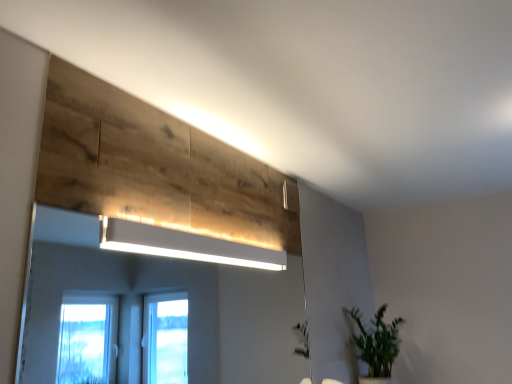
Identify the location of white glossy mirror at upper center. (165, 292).

Locate an element on the screen. The image size is (512, 384). white glossy mirror at upper center is located at coordinates point(165,292).

Is white matte rectangular light at upper center not near white glossy mirror at upper center?

white matte rectangular light at upper center is far away from white glossy mirror at upper center.

At what (x,y) coordinates should I click in order to perform the action: click on mirror below the white matte rectangular light at upper center (from the image's perspective). Please return your answer as a coordinate pair (x, y). This screenshot has width=512, height=384. Looking at the image, I should click on (165, 292).

From a real-world perspective, is white matte rectangular light at upper center above or below white glossy mirror at upper center?

From a real-world perspective, white matte rectangular light at upper center is physically above white glossy mirror at upper center.

Which is more to the left, white matte rectangular light at upper center or white glossy mirror at upper center?

white glossy mirror at upper center.

Does white glossy mirror at upper center have a lesser width compared to white matte rectangular light at upper center?

Yes.

Does white glossy mirror at upper center touch white matte rectangular light at upper center?

white glossy mirror at upper center and white matte rectangular light at upper center are not in contact.

Which object is positioned more to the right, white glossy mirror at upper center or white matte rectangular light at upper center?

From the viewer's perspective, white matte rectangular light at upper center appears more on the right side.

Can you see white glossy mirror at upper center touching green leafy plant at lower right?

No, white glossy mirror at upper center is not making contact with green leafy plant at lower right.

Does white glossy mirror at upper center lie in front of green leafy plant at lower right?

Yes.

Which is more to the left, white glossy mirror at upper center or green leafy plant at lower right?

From the viewer's perspective, white glossy mirror at upper center appears more on the left side.

Is white glossy mirror at upper center turned away from green leafy plant at lower right?

That's not correct — white glossy mirror at upper center is not looking away from green leafy plant at lower right.

From a real-world perspective, does green leafy plant at lower right stand above white matte rectangular light at upper center?

No, from a real-world perspective, green leafy plant at lower right is not above white matte rectangular light at upper center.

Consider the image. From the image's perspective, which object appears higher, green leafy plant at lower right or white matte rectangular light at upper center?

white matte rectangular light at upper center, from the image's perspective.

Is green leafy plant at lower right far away from white matte rectangular light at upper center?

Yes, green leafy plant at lower right and white matte rectangular light at upper center are quite far apart.

Which object is wider, green leafy plant at lower right or white matte rectangular light at upper center?

green leafy plant at lower right is wider.

From a real-world perspective, is white matte rectangular light at upper center located beneath green leafy plant at lower right?

No, from a real-world perspective, white matte rectangular light at upper center is not under green leafy plant at lower right.

Is green leafy plant at lower right at the back of white matte rectangular light at upper center?

white matte rectangular light at upper center does not have its back to green leafy plant at lower right.

Looking at this image, considering the sizes of objects white matte rectangular light at upper center and green leafy plant at lower right in the image provided, who is smaller, white matte rectangular light at upper center or green leafy plant at lower right?

white matte rectangular light at upper center.

Which of these two, green leafy plant at lower right or white glossy mirror at upper center, is bigger?

green leafy plant at lower right.

Which of these two, green leafy plant at lower right or white glossy mirror at upper center, is wider?

With larger width is green leafy plant at lower right.

Based on the photo, in the image, is green leafy plant at lower right positioned in front of or behind white glossy mirror at upper center?

green leafy plant at lower right is positioned farther from the viewer than white glossy mirror at upper center.

Is the surface of green leafy plant at lower right in direct contact with white glossy mirror at upper center?

No, green leafy plant at lower right is not with white glossy mirror at upper center.

At what (x,y) coordinates should I click in order to perform the action: click on mirror in front of the white matte rectangular light at upper center. Please return your answer as a coordinate pair (x, y). This screenshot has height=384, width=512. Looking at the image, I should click on (165, 292).

Find the location of a particular element. This screenshot has width=512, height=384. lamp on the right side of white glossy mirror at upper center is located at coordinates (185, 245).

From the image, which object appears to be nearer to white glossy mirror at upper center, green leafy plant at lower right or white matte rectangular light at upper center?

green leafy plant at lower right is positioned closer to the anchor white glossy mirror at upper center.

Estimate the real-world distances between objects in this image. Which object is closer to white matte rectangular light at upper center, white glossy mirror at upper center or green leafy plant at lower right?

green leafy plant at lower right is positioned closer to the anchor white matte rectangular light at upper center.

Estimate the real-world distances between objects in this image. Which object is further from green leafy plant at lower right, white glossy mirror at upper center or white matte rectangular light at upper center?

Among the two, white glossy mirror at upper center is located further to green leafy plant at lower right.

Which object lies further to the anchor point white matte rectangular light at upper center, green leafy plant at lower right or white glossy mirror at upper center?

Based on the image, white glossy mirror at upper center appears to be further to white matte rectangular light at upper center.

From the image, which object appears to be farther from white glossy mirror at upper center, white matte rectangular light at upper center or green leafy plant at lower right?

Among the two, white matte rectangular light at upper center is located further to white glossy mirror at upper center.

In the scene shown: Looking at the image, which one is located closer to green leafy plant at lower right, white matte rectangular light at upper center or white glossy mirror at upper center?

Based on the image, white matte rectangular light at upper center appears to be nearer to green leafy plant at lower right.

The width and height of the screenshot is (512, 384). I want to click on lamp between white glossy mirror at upper center and green leafy plant at lower right in the front-back direction, so click(185, 245).